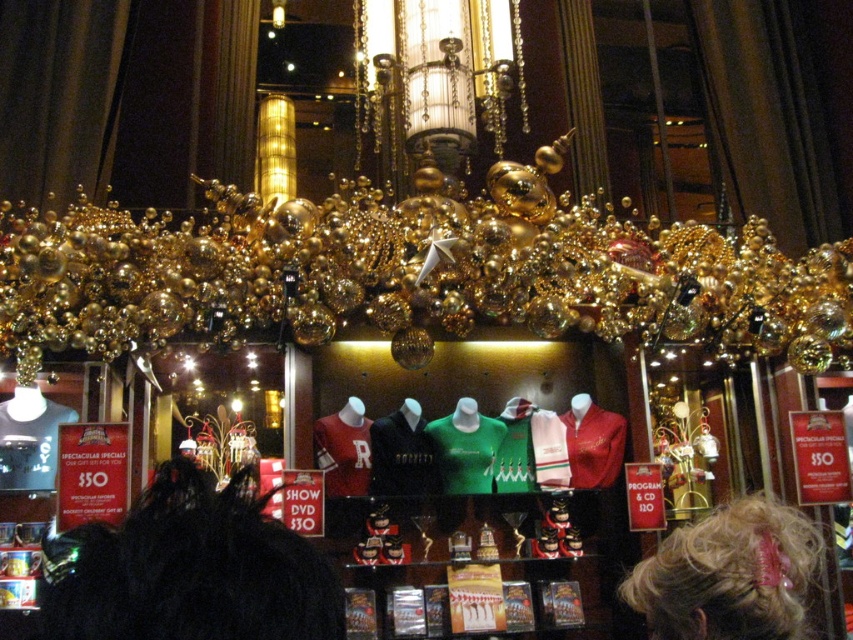
Who is higher up, black fur coat at center or green jersey at center?

black fur coat at center is above.

Does point (294, 589) lie in front of point (444, 474)?

Yes, it is.

Measure the distance between point (229, 627) and camera.

Point (229, 627) is 3.24 meters away from camera.

I want to click on black fur coat at center, so click(x=195, y=570).

Between point (762, 499) and point (315, 422), which one is positioned behind?

The point (315, 422) is behind.

Consider the image. Between blonde hair at upper right and matte red jersey at center, which one appears on the right side from the viewer's perspective?

Positioned to the right is blonde hair at upper right.

Which is behind, point (791, 518) or point (312, 436)?

The point (312, 436) is more distant.

Identify the location of blonde hair at upper right. The width and height of the screenshot is (853, 640). (729, 576).

Can you confirm if black fur coat at center is positioned above blonde hair at upper right?

Yes, black fur coat at center is above blonde hair at upper right.

Between black fur coat at center and blonde hair at upper right, which one has less height?

Standing shorter between the two is black fur coat at center.

Between point (78, 605) and point (776, 632), which one is positioned behind?

The point (776, 632) is more distant.

Find the location of a particular element. The image size is (853, 640). black fur coat at center is located at coordinates (195, 570).